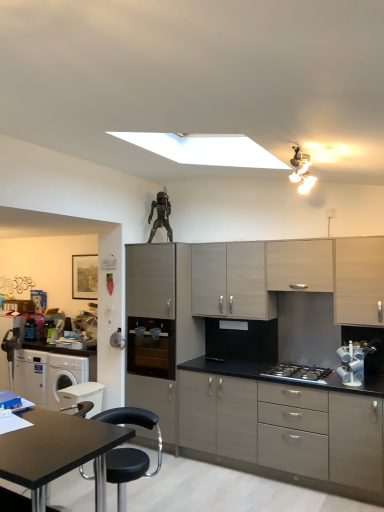
The image size is (384, 512). In order to click on empty space that is ontop of black matte table at lower left (from a real-world perspective) in this screenshot , I will do `click(45, 438)`.